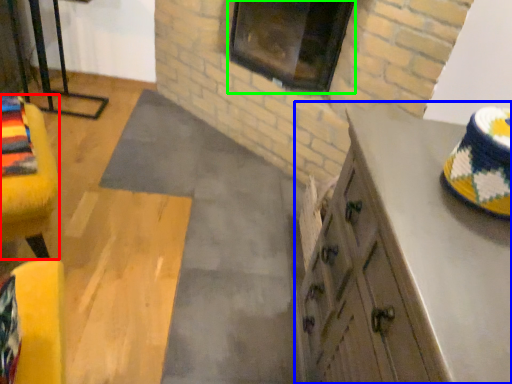
Question: Considering the real-world distances, which object is farthest from furniture (highlighted by a red box)? cabinetry (highlighted by a blue box) or window (highlighted by a green box)?

Choices:
 (A) cabinetry
 (B) window

Answer: (B)